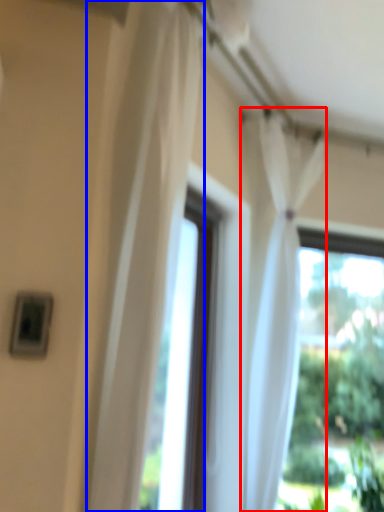
Question: Which object is closer to the camera taking this photo, curtain (highlighted by a red box) or curtain (highlighted by a blue box)?

Choices:
 (A) curtain
 (B) curtain

Answer: (B)